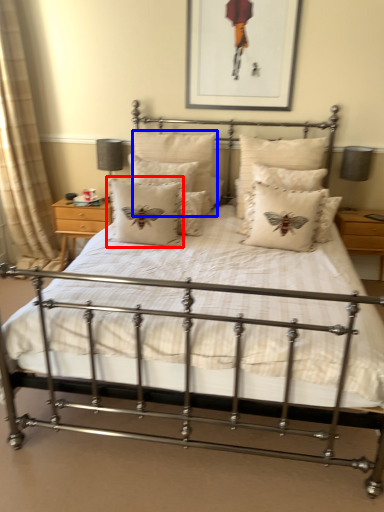
Question: Among these objects, which one is farthest to the camera, pillow (highlighted by a red box) or pillow (highlighted by a blue box)?

Choices:
 (A) pillow
 (B) pillow

Answer: (B)